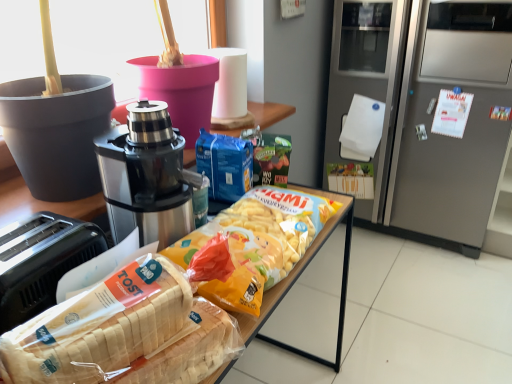
Question: Relative to white plastic bread at lower left, is white glossy refrigerator at right in front or behind?

Choices:
 (A) behind
 (B) front

Answer: (B)

Question: Visually, is white glossy refrigerator at right positioned to the left or to the right of white plastic bread at lower left?

Choices:
 (A) left
 (B) right

Answer: (A)

Question: Based on their relative distances, which object is nearer to the white plastic bread at lower left?

Choices:
 (A) stainless steel coffee maker at center
 (B) satin silver refrigerator at right
 (C) white glossy refrigerator at right

Answer: (C)

Question: Which object is the closest to the stainless steel coffee maker at center?

Choices:
 (A) white plastic bread at lower left
 (B) satin silver refrigerator at right
 (C) white glossy refrigerator at right

Answer: (C)